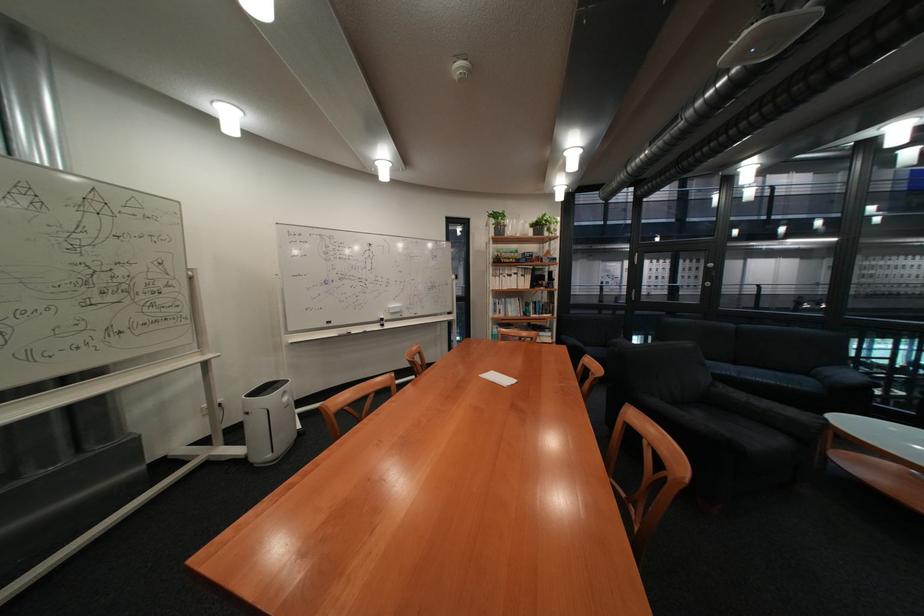
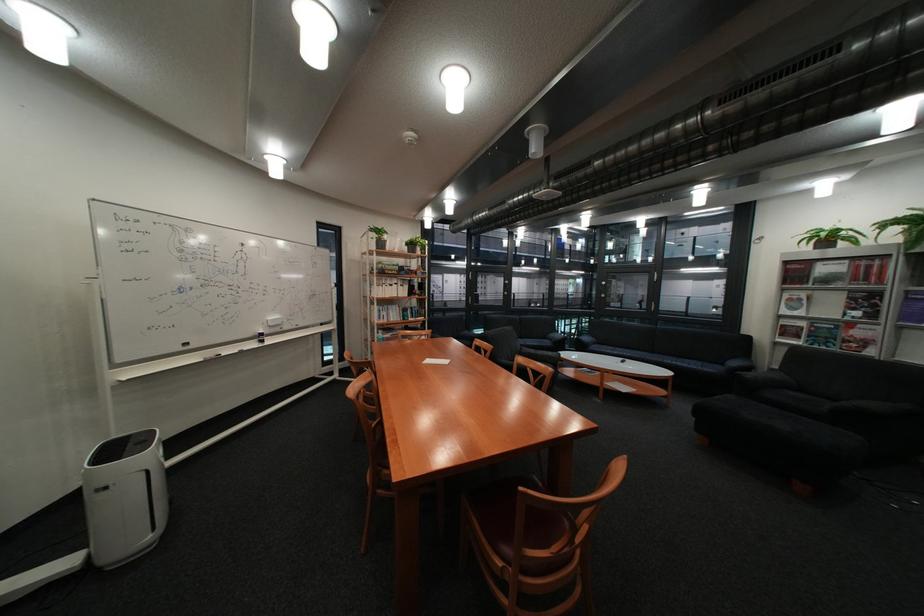
The point at (505, 233) is marked in the first image. Where is the corresponding point in the second image?

(383, 246)